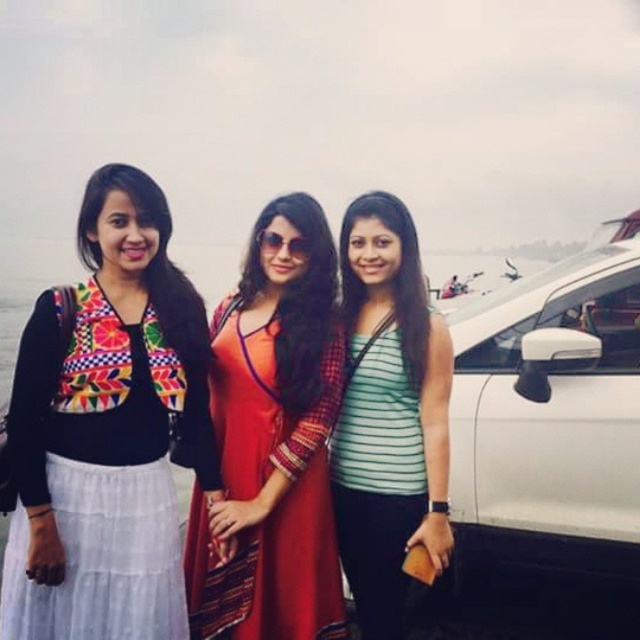
Question: Observing the image, what is the correct spatial positioning of matte red dress at center in reference to black cotton dress at left?

Choices:
 (A) left
 (B) right

Answer: (B)

Question: Does white glossy car at right have a greater width compared to green striped tank top at center?

Choices:
 (A) no
 (B) yes

Answer: (B)

Question: Which object is closer to the camera taking this photo?

Choices:
 (A) black cotton dress at left
 (B) white glossy car at right
 (C) green striped tank top at center

Answer: (A)

Question: Which object is the farthest from the black cotton dress at left?

Choices:
 (A) green striped tank top at center
 (B) matte red dress at center
 (C) white glossy car at right

Answer: (C)

Question: Which of the following is the farthest from the observer?

Choices:
 (A) black cotton dress at left
 (B) white glossy car at right

Answer: (B)

Question: Where is white glossy car at right located in relation to matte red dress at center in the image?

Choices:
 (A) left
 (B) right

Answer: (B)